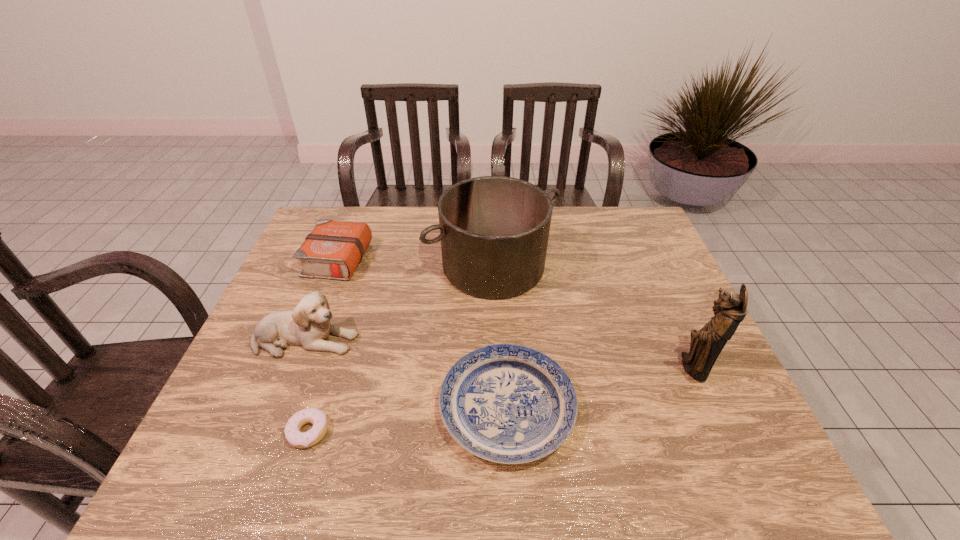
Where is `vacant space that satisfies the following two spatial constraints: 1. on the front side of the second shortest object; 2. on the left side of the third shortest object`? The height and width of the screenshot is (540, 960). vacant space that satisfies the following two spatial constraints: 1. on the front side of the second shortest object; 2. on the left side of the third shortest object is located at coordinates (277, 408).